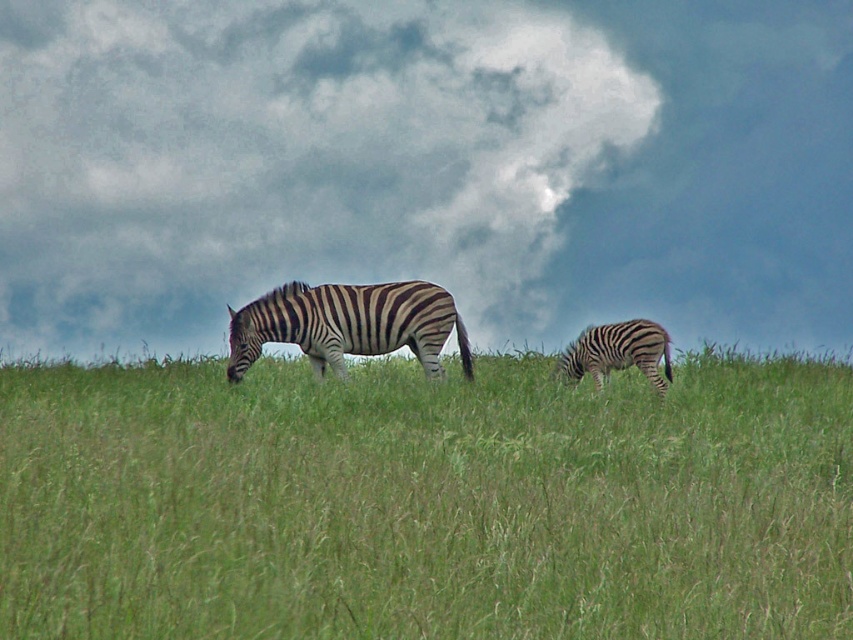
You are a photographer trying to capture a clear shot of the black and white striped zebra at center. However, the green grass at center is blocking your view. Can you move to the left or right to get a better angle?

Since the green grass at center is positioned on the right side of the black and white striped zebra at center, moving to the left would allow you to avoid the grass obstruction and get a clearer view of the zebra.

You are standing in the savanna scene and want to walk from point A to point B. Point A is at coordinate point (392, 410) and point B is at coordinate point (38, 289). Which point is closer to you when you start?

Point A at coordinate point (392, 410) is closer to the viewer than point B at coordinate point (38, 289), so you will start closer to point A.